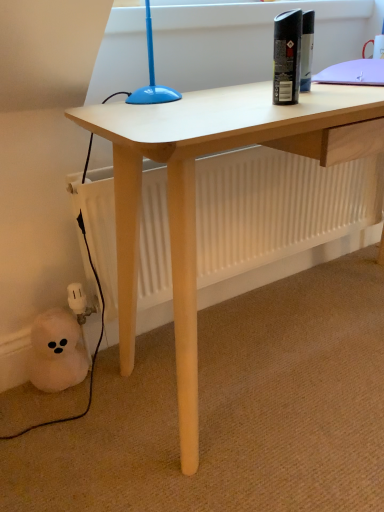
Find the location of `free spot to the right of black rubber cable at lower left`. free spot to the right of black rubber cable at lower left is located at coordinates (135, 378).